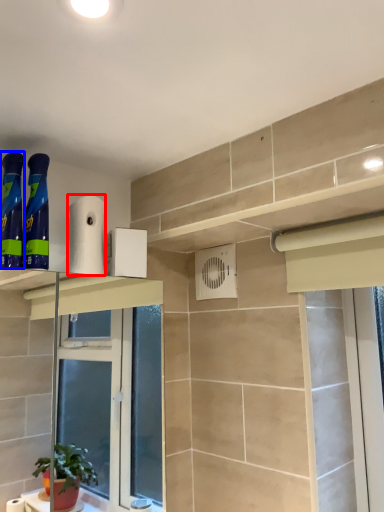
Question: Which object appears closest to the camera in this image, toilet paper (highlighted by a red box) or cleaning product (highlighted by a blue box)?

Choices:
 (A) toilet paper
 (B) cleaning product

Answer: (B)